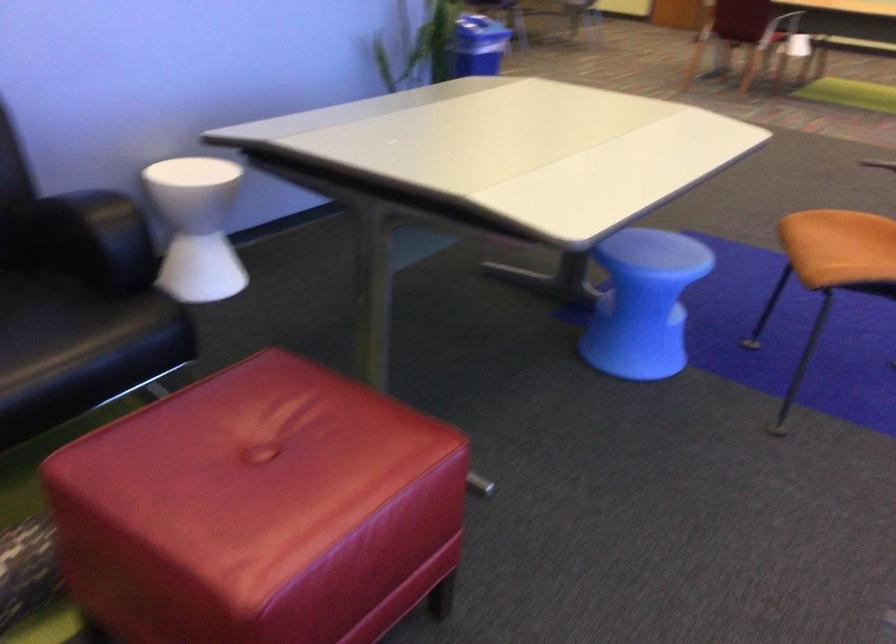
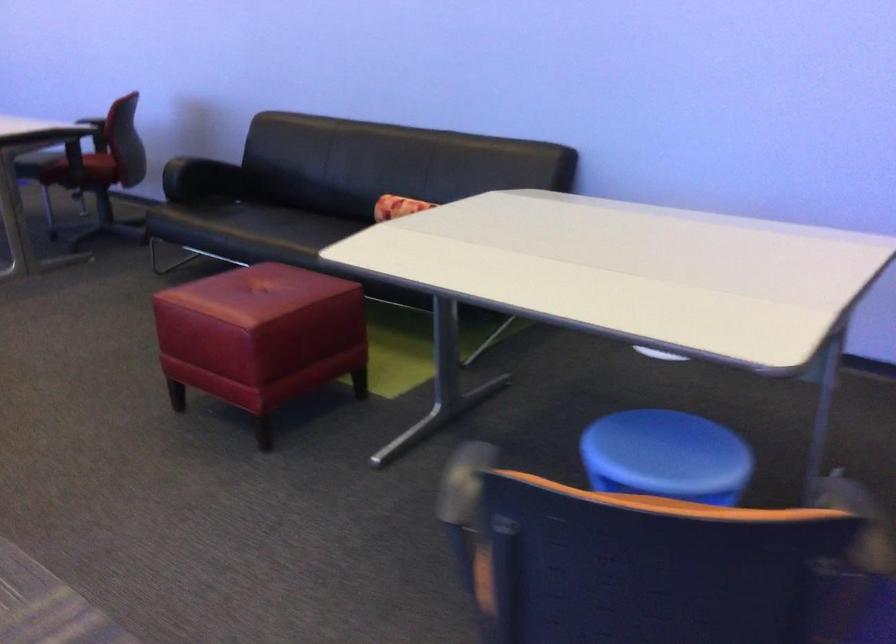
Find the pixel in the second image that matches the point at 675,247 in the first image.

(666, 456)